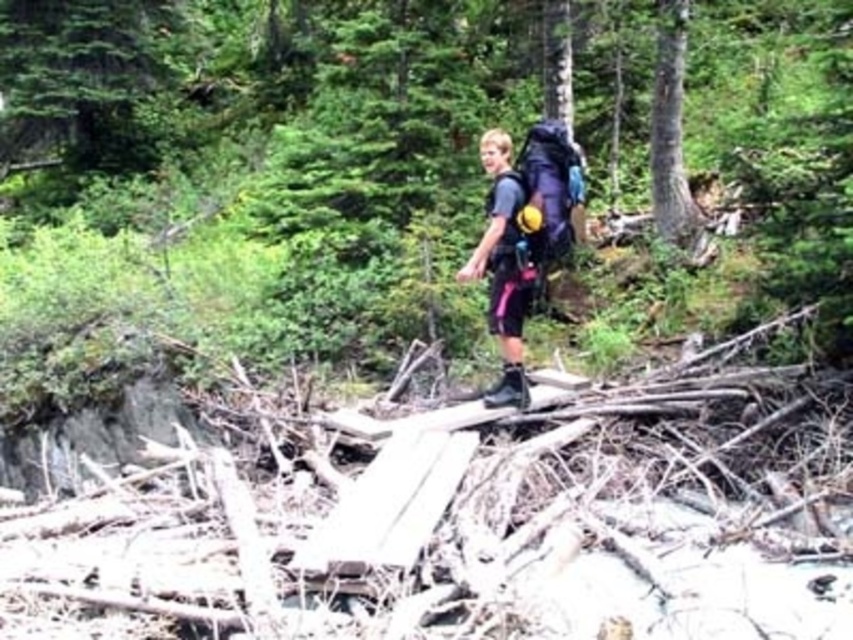
Question: Which of the following is the closest to the observer?

Choices:
 (A) dark gray fabric backpack at center
 (B) black rubber boot at center

Answer: (A)

Question: Is dark gray fabric backpack at center above black rubber boot at center?

Choices:
 (A) no
 (B) yes

Answer: (B)

Question: Considering the relative positions of dark gray fabric backpack at center and black rubber boot at center in the image provided, where is dark gray fabric backpack at center located with respect to black rubber boot at center?

Choices:
 (A) left
 (B) right

Answer: (A)

Question: Is dark gray fabric backpack at center below black rubber boot at center?

Choices:
 (A) no
 (B) yes

Answer: (A)